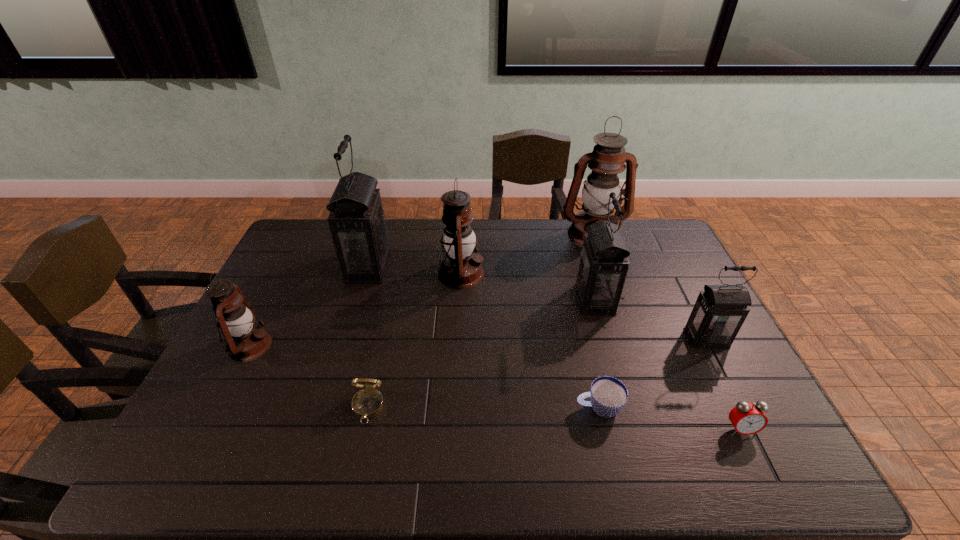
Locate an element on the screen. object that is positioned at the far right corner is located at coordinates (609, 155).

In order to click on vacant space at the far edge of the desktop in this screenshot , I will do `click(501, 248)`.

I want to click on free spot at the left edge of the desktop, so click(227, 396).

Identify the location of vacant space at the right edge of the desktop. The height and width of the screenshot is (540, 960). (715, 349).

The image size is (960, 540). I want to click on free space between the leftmost gray lantern and the second biggest brown lantern, so click(x=415, y=271).

Locate an element on the screen. vacant region between the compass and the nearest brown lantern is located at coordinates 309,376.

Locate an element on the screen. The width and height of the screenshot is (960, 540). free space between the red alarm clock and the smallest gray lantern is located at coordinates (723, 384).

Find the location of a particular element. The width and height of the screenshot is (960, 540). vacant point located between the alarm clock and the cup is located at coordinates (669, 418).

You are a GUI agent. You are given a task and a screenshot of the screen. Output one action in this format:
    pyautogui.click(x=<x>, y=<y>)
    Task: Click on the free space between the blue cup and the second smallest gray lantern
    
    Given the screenshot: What is the action you would take?
    pyautogui.click(x=597, y=354)

Find the location of a particular element. The width and height of the screenshot is (960, 540). free space that is in between the second lantern from left to right and the second smallest brown lantern is located at coordinates (415, 271).